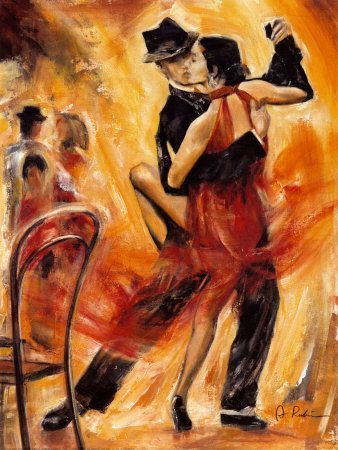
Identify the location of painting of a man and woman dancing. This screenshot has height=450, width=338. pyautogui.click(x=107, y=9).